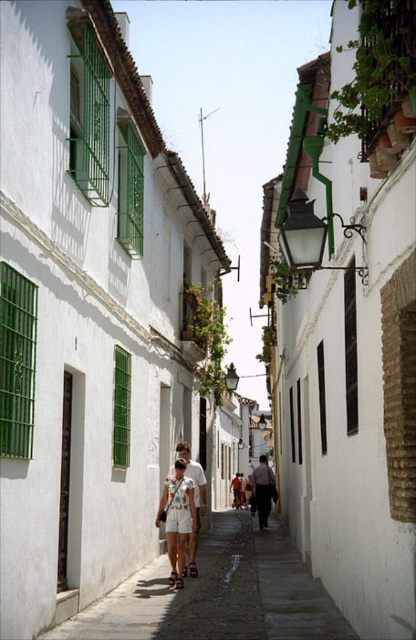
This screenshot has width=416, height=640. What do you see at coordinates (220, 595) in the screenshot?
I see `smooth concrete pavement at center` at bounding box center [220, 595].

Is point (170, 614) farther from camera compared to point (173, 472)?

No, it is in front of (173, 472).

Does point (277, 584) come in front of point (185, 476)?

That is True.

You are a GUI agent. You are given a task and a screenshot of the screen. Output one action in this format:
    pyautogui.click(x=<x>, y=<y>)
    Task: Click on the smooth concrete pavement at center
    The height and width of the screenshot is (640, 416).
    Given the screenshot: What is the action you would take?
    pyautogui.click(x=220, y=595)

Is white cotton shorts at center positioned behind green metal shutter at lower left?

No, it is in front of green metal shutter at lower left.

Does white cotton shorts at center have a lesser width compared to green metal shutter at lower left?

No, white cotton shorts at center is not thinner than green metal shutter at lower left.

Who is more distant from viewer, (195, 522) or (128, 451)?

The point (128, 451) is more distant.

In order to click on white cotton shorts at center in this screenshot , I will do `click(176, 518)`.

Can you confirm if green metal bars at left is shorter than pink fabric shirt at center?

Correct, green metal bars at left is not as tall as pink fabric shirt at center.

Which is in front, point (15, 449) or point (269, 488)?

Positioned in front is point (15, 449).

The width and height of the screenshot is (416, 640). Describe the element at coordinates (17, 362) in the screenshot. I see `green metal bars at left` at that location.

This screenshot has width=416, height=640. In order to click on green metal bars at left in this screenshot , I will do `click(17, 362)`.